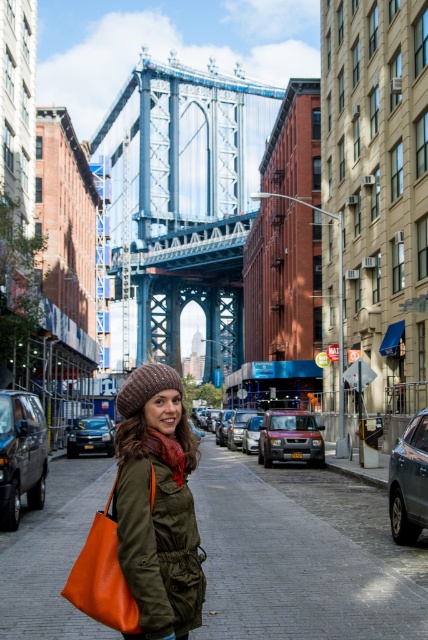
Is point (136, 474) positioned after point (311, 420)?

No, (136, 474) is in front of (311, 420).

Find the location of a particular element. matte olive green jacket at center is located at coordinates (157, 506).

Who is lower down, shiny silver car at right or orange knitted scarf at center?

shiny silver car at right

How far apart are shiny silver car at right and orange knitted scarf at center?

A distance of 6.99 meters exists between shiny silver car at right and orange knitted scarf at center.

Image resolution: width=428 pixels, height=640 pixels. In order to click on shiny silver car at right in this screenshot , I will do 409,481.

Does shiny silver car at right have a larger size compared to matte red suv at center?

No, shiny silver car at right is not bigger than matte red suv at center.

Which is in front, point (404, 500) or point (278, 416)?

Positioned in front is point (404, 500).

This screenshot has height=640, width=428. I want to click on shiny silver car at right, so click(x=409, y=481).